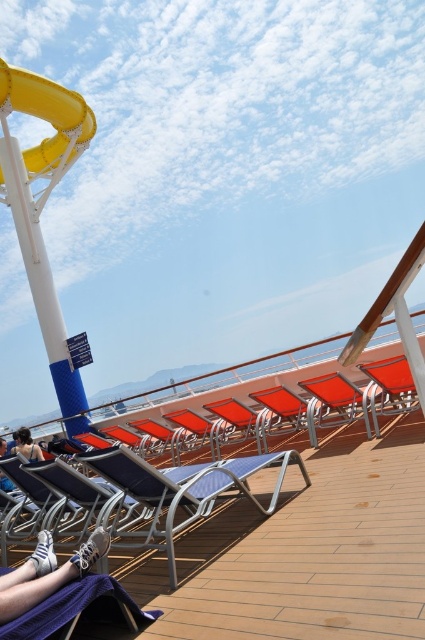
Is point (90, 120) positioned after point (30, 433)?

Yes, it is behind point (30, 433).

The image size is (425, 640). Describe the element at coordinates (48, 116) in the screenshot. I see `yellow rubber slide at upper left` at that location.

Image resolution: width=425 pixels, height=640 pixels. I want to click on yellow rubber slide at upper left, so click(48, 116).

Can you confirm if yellow rubber slide at upper left is shorter than orange fabric beach chair at center?

In fact, yellow rubber slide at upper left may be taller than orange fabric beach chair at center.

Which is in front, point (81, 131) or point (314, 422)?

Point (314, 422)

Locate an element on the screen. The height and width of the screenshot is (640, 425). yellow rubber slide at upper left is located at coordinates (48, 116).

Between point (85, 460) and point (322, 388), which one is positioned in front?

Point (85, 460) is in front.

Which is more to the right, blue fabric beach chair at center or orange fabric beach chair at center?

Positioned to the right is orange fabric beach chair at center.

Which is in front, point (212, 461) or point (317, 394)?

Point (212, 461) is more forward.

I want to click on blue fabric beach chair at center, so click(175, 493).